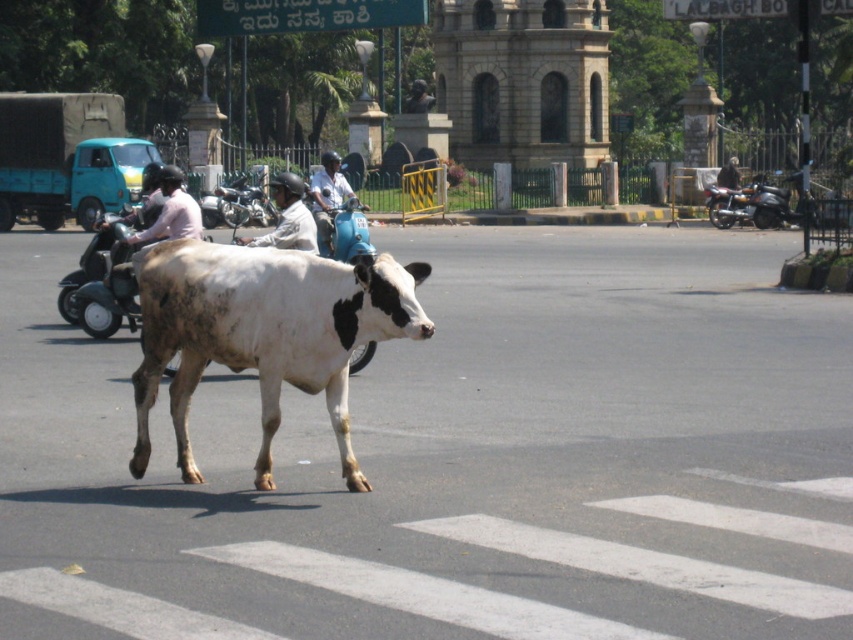
You are a delivery rider on a metallic blue motorcycle at center and need to pass a white speckled cow at center that is crossing the road. Considering the cow is taller than your motorcycle, what should you do to safely navigate around it?

Since the white speckled cow at center is taller than the metallic blue motorcycle at center, you should proceed with caution and ensure there is enough vertical clearance to pass safely, possibly slowing down or adjusting your path to avoid any collision with the cow.

You are a delivery person needing to place a small package on either the metallic blue scooter at left or the light brown leather helmet at center. Based on their sizes, which object can more safely accommodate the package without it falling off?

The metallic blue scooter at left has a larger size compared to the light brown leather helmet at center, so the metallic blue scooter at left can more safely accommodate the small package without it falling off.